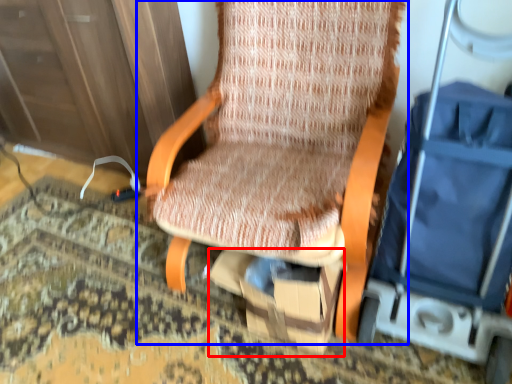
Question: Which object appears farthest to the camera in this image, cardboard box (highlighted by a red box) or chair (highlighted by a blue box)?

Choices:
 (A) cardboard box
 (B) chair

Answer: (A)